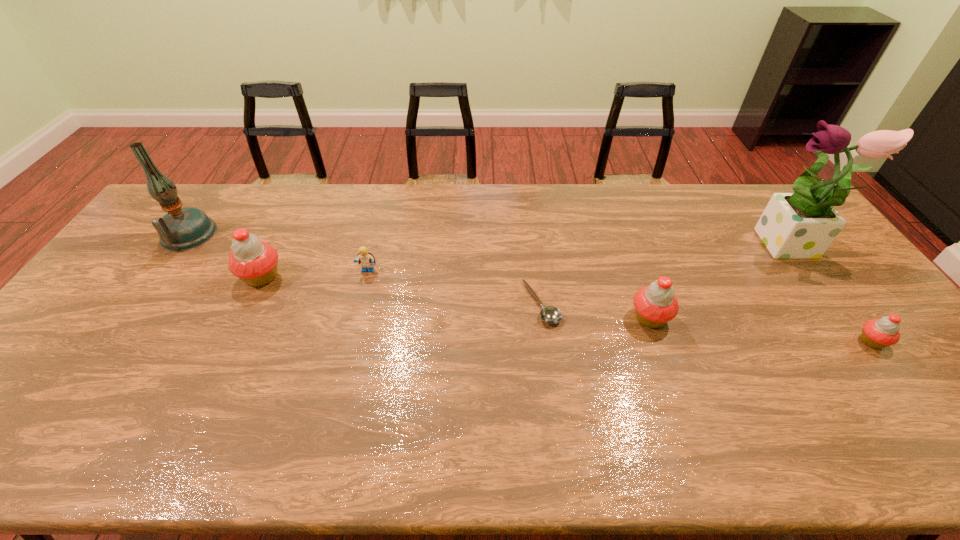
Please point a space for a new cupcake to maintain equal intervals. Please provide its 2D coordinates. Your answer should be formatted as a tuple, i.e. [(x, y)], where the tuple contains the x and y coordinates of a point satisfying the conditions above.

[(447, 296)]